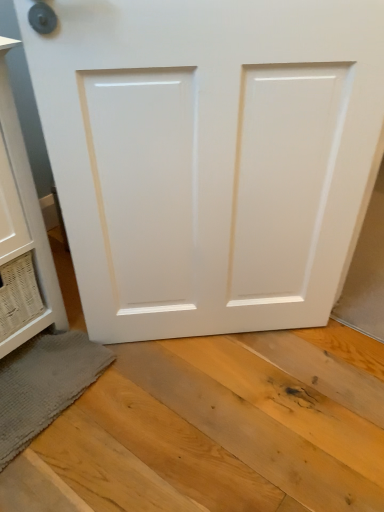
Question: Is white glossy cabinet at left further to camera compared to white glossy door at center?

Choices:
 (A) no
 (B) yes

Answer: (A)

Question: Can you confirm if white glossy cabinet at left is positioned to the left of white glossy door at center?

Choices:
 (A) yes
 (B) no

Answer: (A)

Question: Could white glossy door at center be considered to be inside white glossy cabinet at left?

Choices:
 (A) yes
 (B) no

Answer: (B)

Question: Can you confirm if white glossy cabinet at left is wider than white glossy door at center?

Choices:
 (A) no
 (B) yes

Answer: (B)

Question: Does white glossy cabinet at left have a lesser width compared to white glossy door at center?

Choices:
 (A) no
 (B) yes

Answer: (A)

Question: Is white glossy door at center wider or thinner than white glossy cabinet at left?

Choices:
 (A) wide
 (B) thin

Answer: (B)

Question: From a real-world perspective, is white glossy door at center physically located above or below white glossy cabinet at left?

Choices:
 (A) above
 (B) below

Answer: (A)

Question: Which is correct: white glossy door at center is inside white glossy cabinet at left, or outside of it?

Choices:
 (A) inside
 (B) outside

Answer: (B)

Question: In the image, is white glossy door at center positioned in front of or behind white glossy cabinet at left?

Choices:
 (A) front
 (B) behind

Answer: (B)

Question: Is gray textured bath mat at lower left spatially inside white glossy door at center, or outside of it?

Choices:
 (A) inside
 (B) outside

Answer: (B)

Question: Is gray textured bath mat at lower left in front of or behind white glossy door at center in the image?

Choices:
 (A) behind
 (B) front

Answer: (A)

Question: From a real-world perspective, is gray textured bath mat at lower left physically located above or below white glossy door at center?

Choices:
 (A) below
 (B) above

Answer: (A)

Question: Is gray textured bath mat at lower left wider or thinner than white glossy door at center?

Choices:
 (A) thin
 (B) wide

Answer: (B)

Question: From a real-world perspective, relative to white glossy cabinet at left, is gray textured bath mat at lower left vertically above or below?

Choices:
 (A) above
 (B) below

Answer: (B)

Question: Is gray textured bath mat at lower left inside or outside of white glossy cabinet at left?

Choices:
 (A) inside
 (B) outside

Answer: (B)